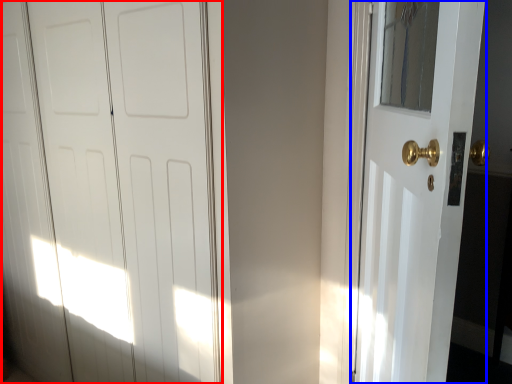
Question: Which point is further to the camera, door (highlighted by a red box) or door (highlighted by a blue box)?

Choices:
 (A) door
 (B) door

Answer: (A)